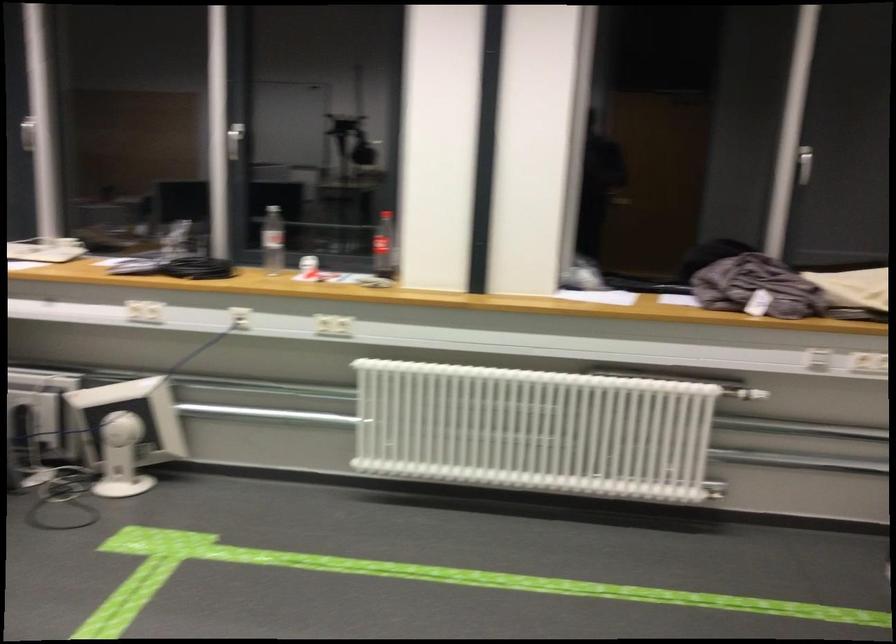
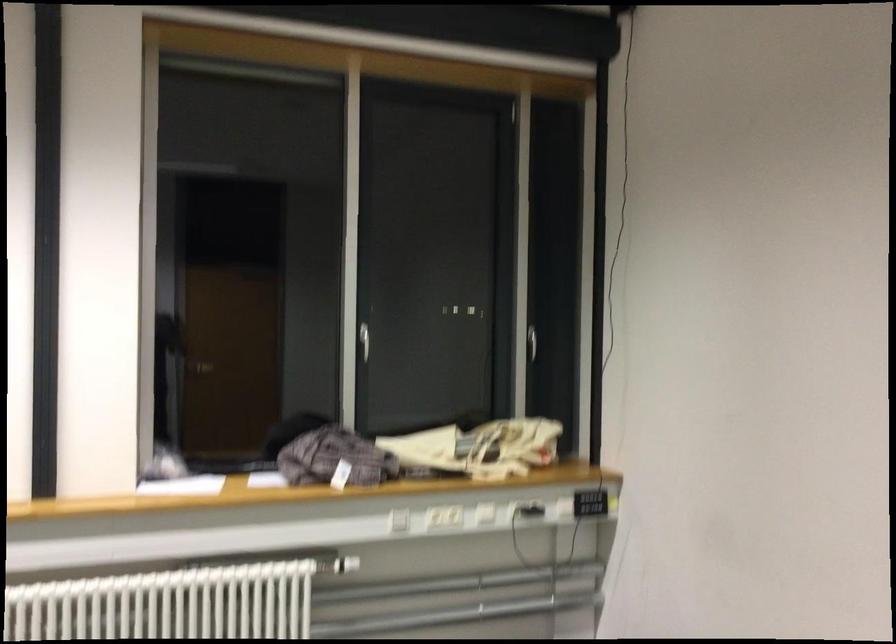
Question: The images are taken continuously from a first-person perspective. In which direction is your viewpoint rotating?

Choices:
 (A) Left
 (B) Right
 (C) Up
 (D) Down

Answer: (B)